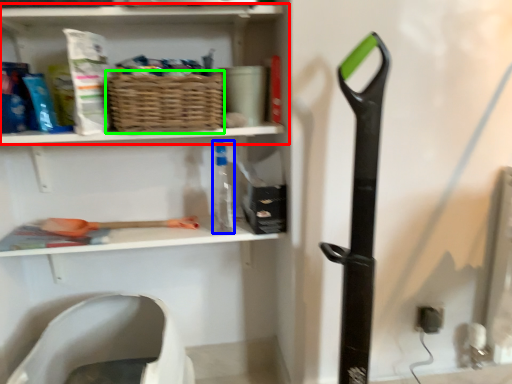
Question: Which object is positioned farthest from shelf (highlighted by a red box)? Select from bottle (highlighted by a blue box) and basket (highlighted by a green box).

Choices:
 (A) bottle
 (B) basket

Answer: (A)